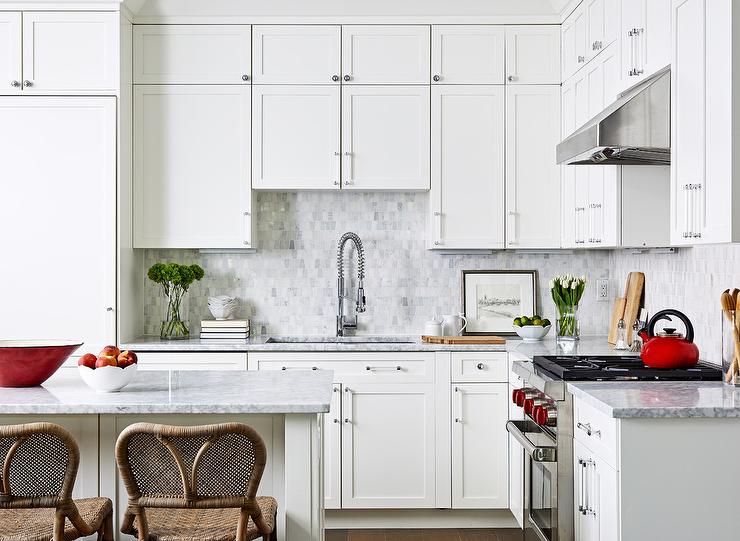
I want to click on floor, so (399, 516).